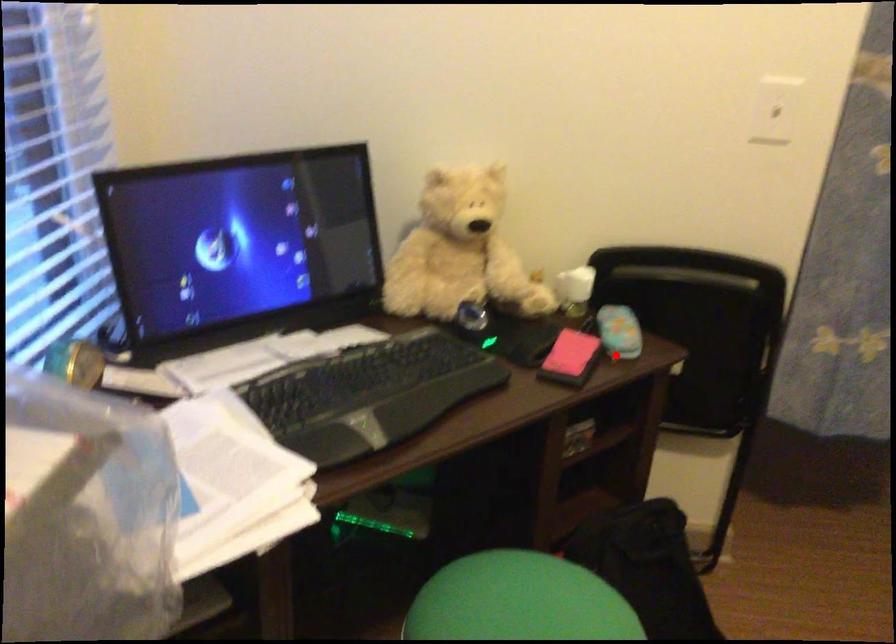
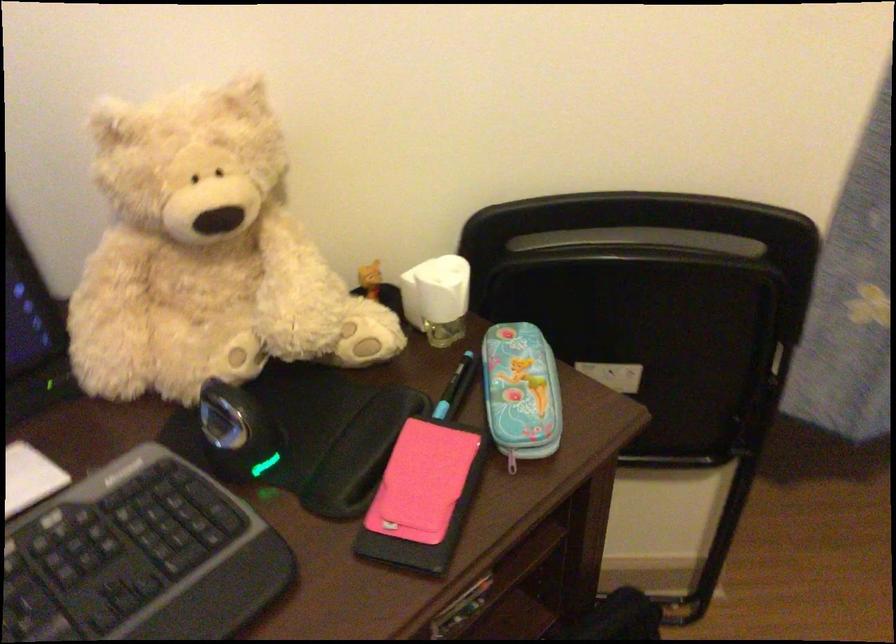
Question: I am providing you with two images of the same scene from different viewpoints. A red point is shown in image1. For the corresponding object point in image2, is it positioned nearer or farther from the camera?

Choices:
 (A) Nearer
 (B) Farther

Answer: (A)